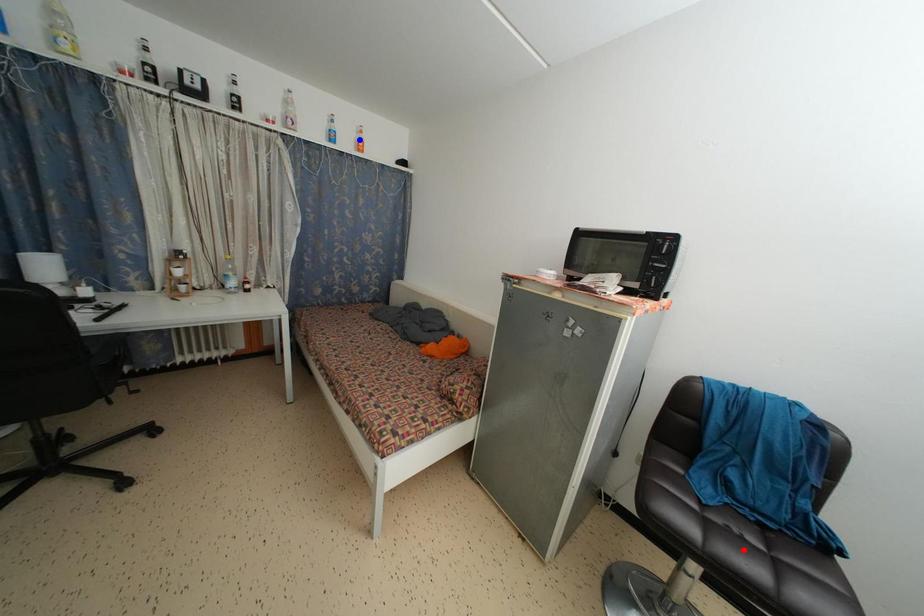
Question: In the image, two points are highlighted. Which point is nearer to the camera? Reply with the corresponding letter.

Choices:
 (A) blue point
 (B) red point

Answer: (B)